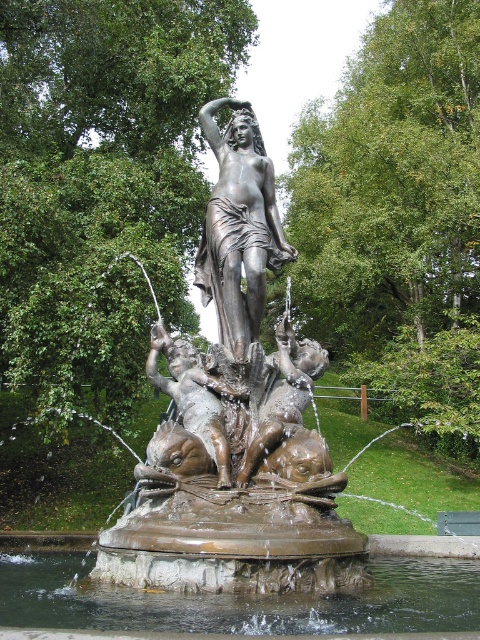
Question: Does shiny bronze statue at center have a smaller size compared to bronze cherub at center?

Choices:
 (A) no
 (B) yes

Answer: (A)

Question: Among these objects, which one is nearest to the camera?

Choices:
 (A) bronze/smooth cherub at center
 (B) clear water at fountain center
 (C) bronze statue at center

Answer: (B)

Question: Does bronze statue at center have a larger size compared to bronze cherub at center?

Choices:
 (A) no
 (B) yes

Answer: (B)

Question: Which point is closer to the camera taking this photo?

Choices:
 (A) (279, 227)
 (B) (202, 248)

Answer: (A)

Question: Which of the following is the farthest from the observer?

Choices:
 (A) clear water at fountain center
 (B) bronze/smooth cherub at center
 (C) bronze statue at center
 (D) bronze cherub at center

Answer: (B)

Question: Where is clear water at fountain center located in relation to bronze/smooth cherub at center in the image?

Choices:
 (A) right
 (B) left

Answer: (B)